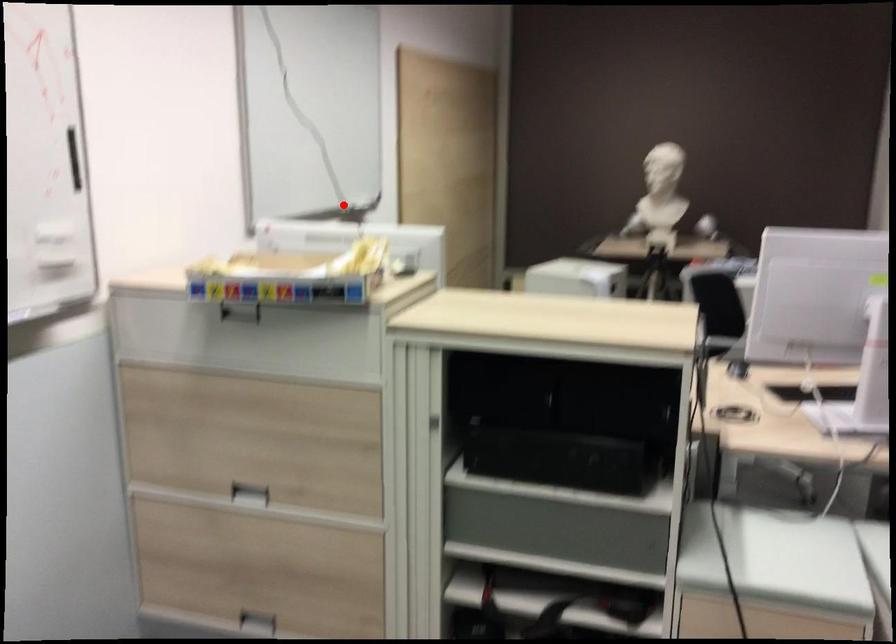
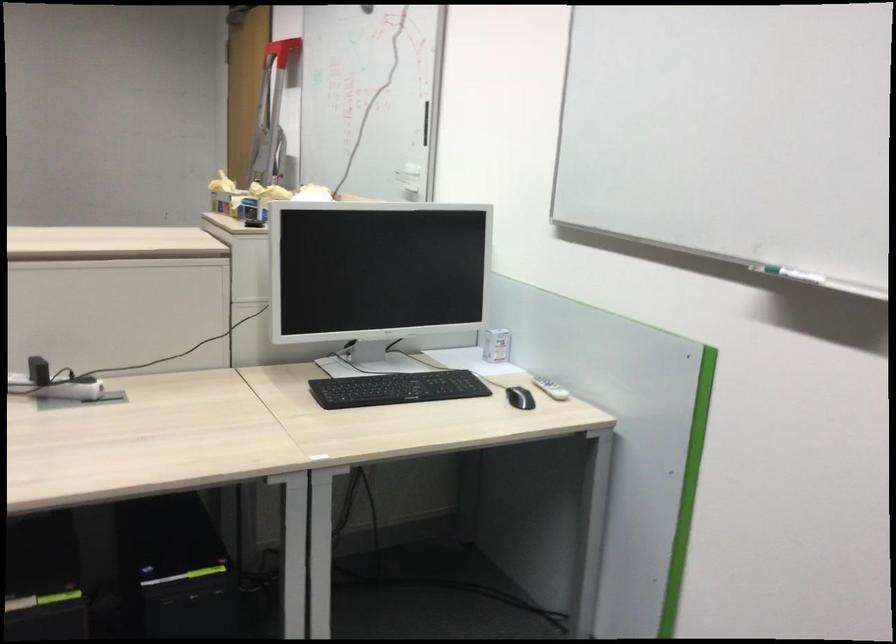
Where in the second image is the point corresponding to the highlighted location from the first image?

(794, 275)